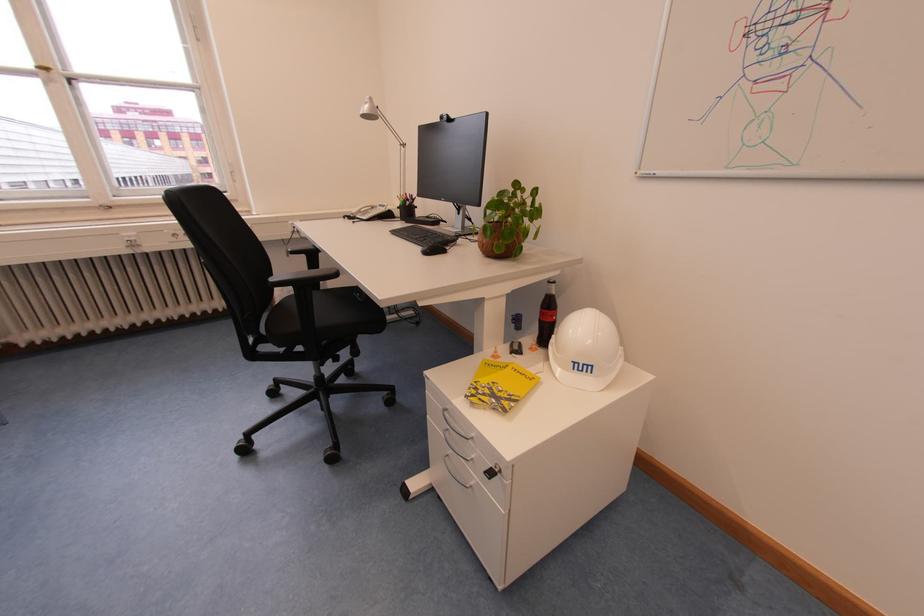
The height and width of the screenshot is (616, 924). Identify the location of drawer key lock. (494, 476).